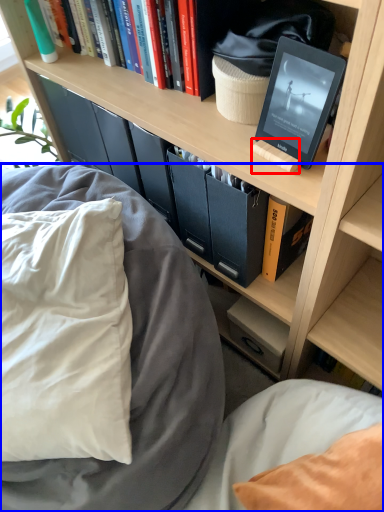
Question: Which of the following is the closest to the observer, book (highlighted by a red box) or bed (highlighted by a blue box)?

Choices:
 (A) book
 (B) bed

Answer: (B)